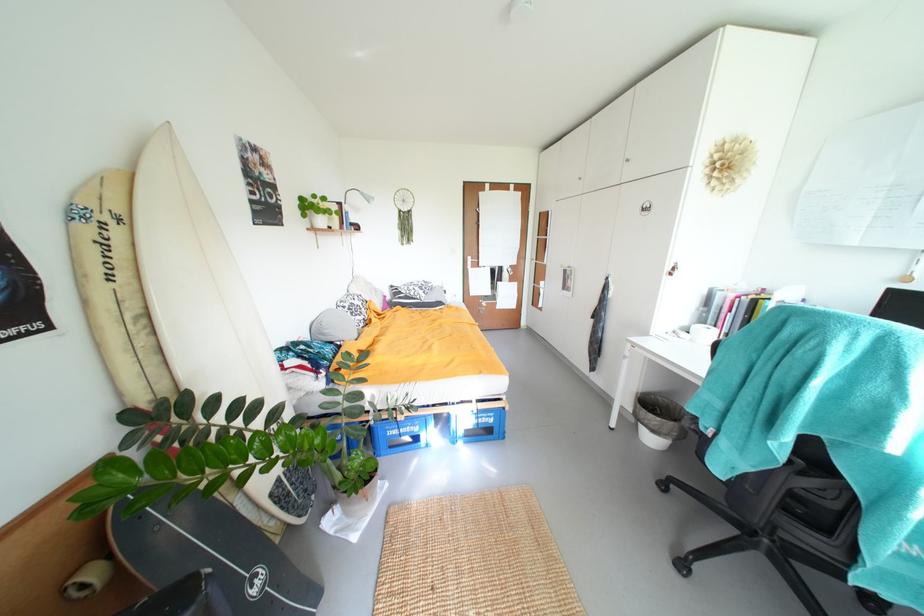
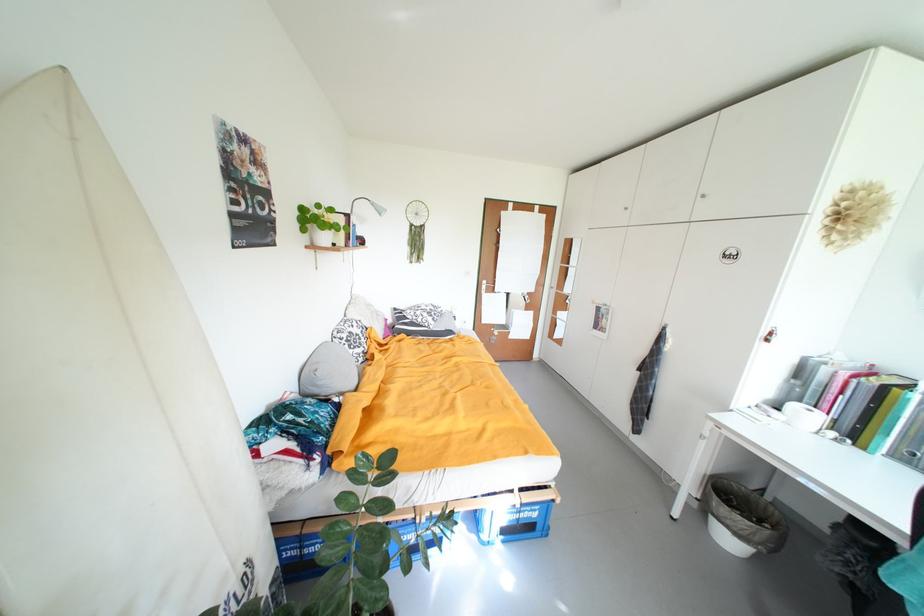
In the second image, find the point that corresponds to [333,333] in the first image.

(326, 385)